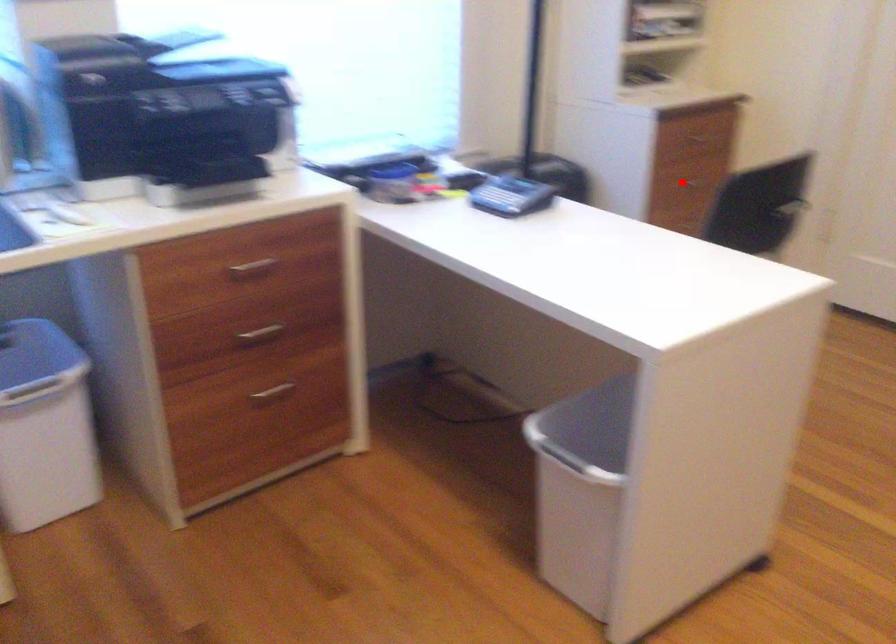
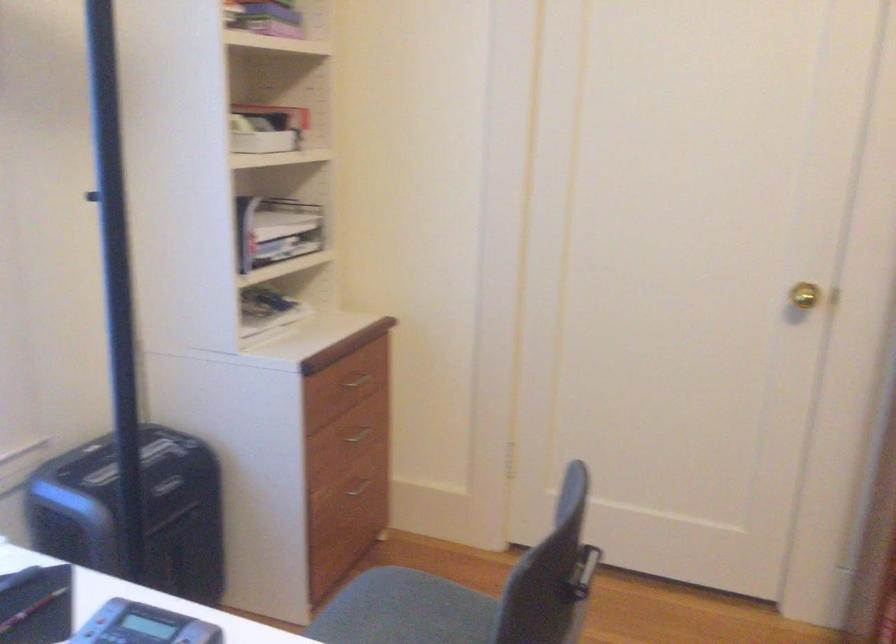
Question: I am providing you with two images of the same scene from different viewpoints. In image1, a red point is highlighted. Considering the same 3D point in image2, which of the following is correct?

Choices:
 (A) It is closer
 (B) It is farther

Answer: (A)